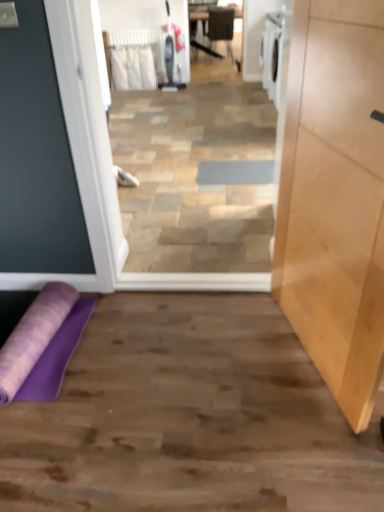
Question: Considering the relative positions of purple fabric yoga mat at lower left and light wood cabinet at right in the image provided, is purple fabric yoga mat at lower left to the right of light wood cabinet at right from the viewer's perspective?

Choices:
 (A) yes
 (B) no

Answer: (B)

Question: Is purple fabric yoga mat at lower left aimed at light wood cabinet at right?

Choices:
 (A) no
 (B) yes

Answer: (A)

Question: Considering the relative sizes of purple fabric yoga mat at lower left and light wood cabinet at right in the image provided, is purple fabric yoga mat at lower left shorter than light wood cabinet at right?

Choices:
 (A) no
 (B) yes

Answer: (B)

Question: Is purple fabric yoga mat at lower left wider than light wood cabinet at right?

Choices:
 (A) no
 (B) yes

Answer: (B)

Question: Is purple fabric yoga mat at lower left looking in the opposite direction of light wood cabinet at right?

Choices:
 (A) no
 (B) yes

Answer: (A)

Question: Considering the relative sizes of purple fabric yoga mat at lower left and light wood cabinet at right in the image provided, is purple fabric yoga mat at lower left thinner than light wood cabinet at right?

Choices:
 (A) no
 (B) yes

Answer: (A)

Question: Can you confirm if light wood cabinet at right is shorter than matte black chair at center?

Choices:
 (A) no
 (B) yes

Answer: (A)

Question: From the image's perspective, does light wood cabinet at right appear higher than matte black chair at center?

Choices:
 (A) yes
 (B) no

Answer: (B)

Question: Considering the relative sizes of light wood cabinet at right and matte black chair at center in the image provided, is light wood cabinet at right bigger than matte black chair at center?

Choices:
 (A) no
 (B) yes

Answer: (A)

Question: Considering the relative sizes of light wood cabinet at right and matte black chair at center in the image provided, is light wood cabinet at right smaller than matte black chair at center?

Choices:
 (A) yes
 (B) no

Answer: (A)

Question: From a real-world perspective, is light wood cabinet at right on matte black chair at center?

Choices:
 (A) yes
 (B) no

Answer: (A)

Question: Considering the relative positions of light wood cabinet at right and matte black chair at center in the image provided, is light wood cabinet at right to the right of matte black chair at center from the viewer's perspective?

Choices:
 (A) no
 (B) yes

Answer: (A)

Question: From the image's perspective, is purple fabric yoga mat at lower left over gray fabric doormat at center?

Choices:
 (A) no
 (B) yes

Answer: (A)